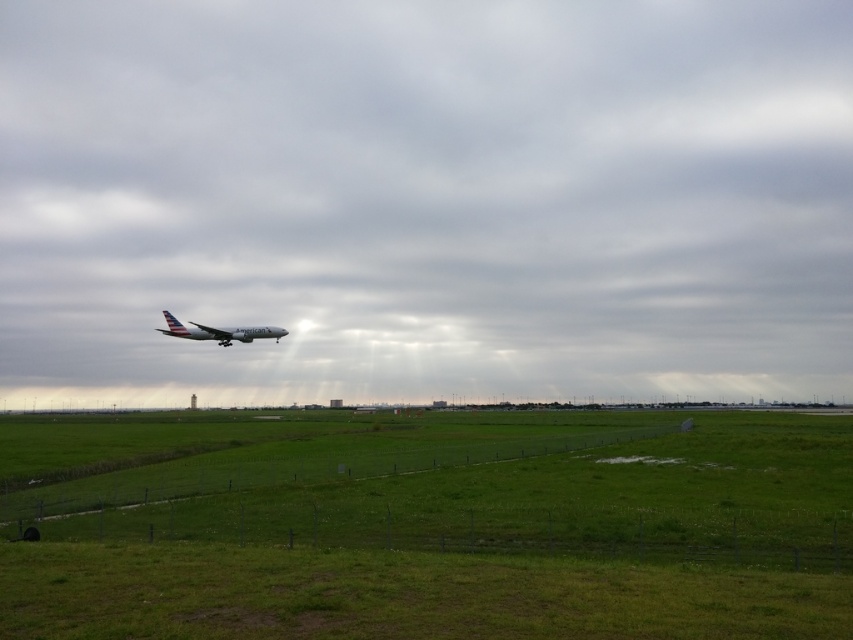
You are standing at the edge of the field and see the transparent glass airplane at center and the green grass at lower center. Which object is closer to you?

The transparent glass airplane at center is closer to you than the green grass at lower center because the green grass at lower center is behind the transparent glass airplane at center.

You are standing at the point of view of the image and want to walk towards the green grass at lower center. Based on the coordinates provided in the Objects Description, can you estimate how far you need to walk horizontally and vertically to reach it?

The green grass at lower center is located at coordinates point [466,541]. This means you need to walk approximately 84.8 percent of the frame width to the right and 54.7 percent of the frame height downward to reach it.

You are standing at the fence and looking at the transparent glass airplane at center and the green grass at lower center. Which object is closer to you?

The green grass at lower center is closer to you because it is positioned below the transparent glass airplane at center, which is above it.